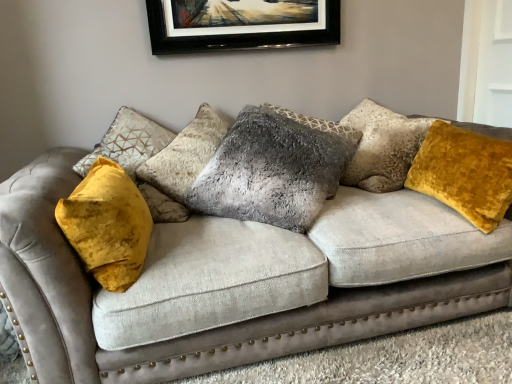
Question: In the image, is velvet gray couch at center on the left side or the right side of fuzzy gray pillow at center, marked as the second pillow in a right-to-left arrangement?

Choices:
 (A) left
 (B) right

Answer: (A)

Question: From a real-world perspective, is velvet gray couch at center positioned above or below fuzzy gray pillow at center, arranged as the 1th pillow when viewed from the left?

Choices:
 (A) above
 (B) below

Answer: (B)

Question: Estimate the real-world distances between objects in this image. Which object is closer to the fuzzy gray pillow at center, arranged as the 1th pillow when viewed from the left?

Choices:
 (A) velvet gray couch at center
 (B) velvet yellow pillow at right, which ranks as the 2th pillow in left-to-right order

Answer: (A)

Question: Estimate the real-world distances between objects in this image. Which object is farther from the velvet gray couch at center?

Choices:
 (A) velvet yellow pillow at right, placed as the first pillow when sorted from right to left
 (B) fuzzy gray pillow at center, arranged as the 1th pillow when viewed from the left

Answer: (A)